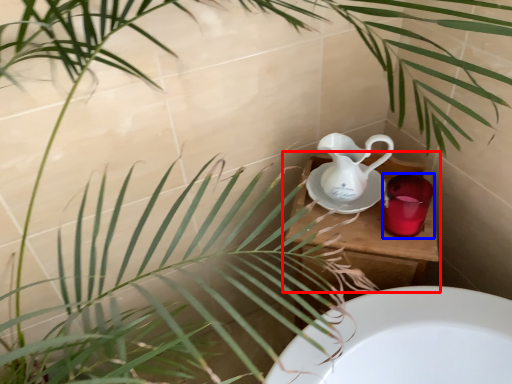
Question: Among these objects, which one is nearest to the camera, table (highlighted by a red box) or mug (highlighted by a blue box)?

Choices:
 (A) table
 (B) mug

Answer: (B)